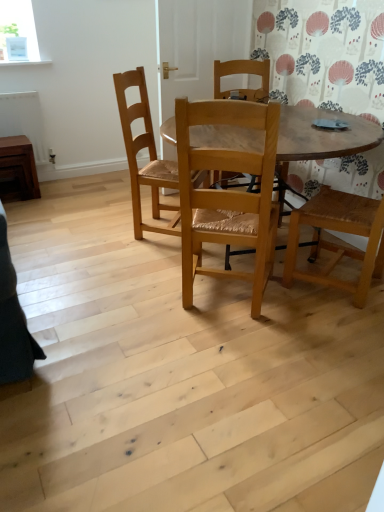
Question: Can you confirm if brown wooden side table at left is wider than natural wood chair at center, the 1th chair in the front-to-back sequence?

Choices:
 (A) yes
 (B) no

Answer: (B)

Question: Can you confirm if brown wooden side table at left is positioned to the right of natural wood chair at center, marked as the 2th chair in a back-to-front arrangement?

Choices:
 (A) yes
 (B) no

Answer: (B)

Question: Is brown wooden side table at left smaller than natural wood chair at center, the 1th chair in the front-to-back sequence?

Choices:
 (A) no
 (B) yes

Answer: (B)

Question: Is brown wooden side table at left behind natural wood chair at center, the 1th chair in the front-to-back sequence?

Choices:
 (A) yes
 (B) no

Answer: (A)

Question: Is the depth of brown wooden side table at left less than that of natural wood chair at center, the 1th chair in the front-to-back sequence?

Choices:
 (A) no
 (B) yes

Answer: (A)

Question: Considering their positions, is brown wooden radiator at left located in front of or behind wooden table at center?

Choices:
 (A) front
 (B) behind

Answer: (B)

Question: Is point (34, 138) positioned closer to the camera than point (347, 136)?

Choices:
 (A) closer
 (B) farther

Answer: (B)

Question: Is brown wooden radiator at left taller or shorter than wooden table at center?

Choices:
 (A) tall
 (B) short

Answer: (B)

Question: Visually, is brown wooden radiator at left positioned to the left or to the right of wooden table at center?

Choices:
 (A) right
 (B) left

Answer: (B)

Question: Is wooden table at center in front of or behind natural wood chair at center, which is counted as the first chair, starting from the back, in the image?

Choices:
 (A) behind
 (B) front

Answer: (B)

Question: Choose the correct answer: Is wooden table at center inside natural wood chair at center, which is counted as the first chair, starting from the back, or outside it?

Choices:
 (A) inside
 (B) outside

Answer: (B)

Question: From a real-world perspective, is wooden table at center physically located above or below natural wood chair at center, which is counted as the first chair, starting from the back?

Choices:
 (A) below
 (B) above

Answer: (A)

Question: Visually, is wooden table at center positioned to the left or to the right of natural wood chair at center, positioned as the 2th chair in front-to-back order?

Choices:
 (A) left
 (B) right

Answer: (B)

Question: Considering the positions of brown wooden side table at left and natural wood chair at center, positioned as the 2th chair in front-to-back order, in the image, is brown wooden side table at left wider or thinner than natural wood chair at center, positioned as the 2th chair in front-to-back order,?

Choices:
 (A) thin
 (B) wide

Answer: (A)

Question: Would you say brown wooden side table at left is to the left or to the right of natural wood chair at center, which is counted as the first chair, starting from the back, in the picture?

Choices:
 (A) right
 (B) left

Answer: (B)